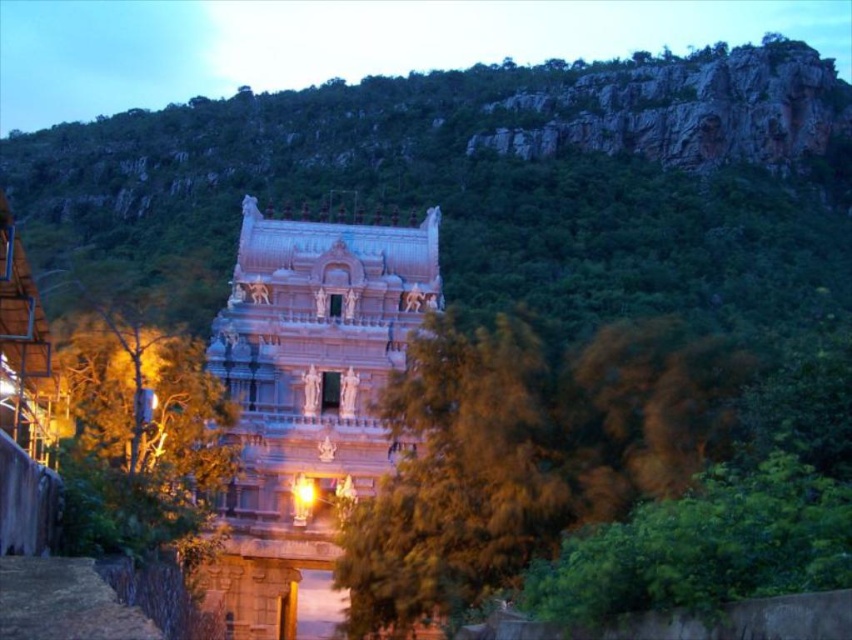
You are a photographer aiming to capture the temple structure with both the green leafy tree at center and the green leafy tree at left in the frame. Based on their positions, which tree is positioned lower in the image?

The green leafy tree at center is positioned lower than the green leafy tree at left.

You are standing in front of the temple and want to take a photo that includes both the temple and the green leafy tree at center. Given that your camera has a maximum focus range of 40 meters, will you be able to capture both subjects in focus without moving closer?

The green leafy tree at center and viewer are 42.68 meters apart from each other. Since the camera can only focus up to 40 meters, the tree is beyond the camera range. Therefore, you cannot capture both subjects in focus without moving closer.